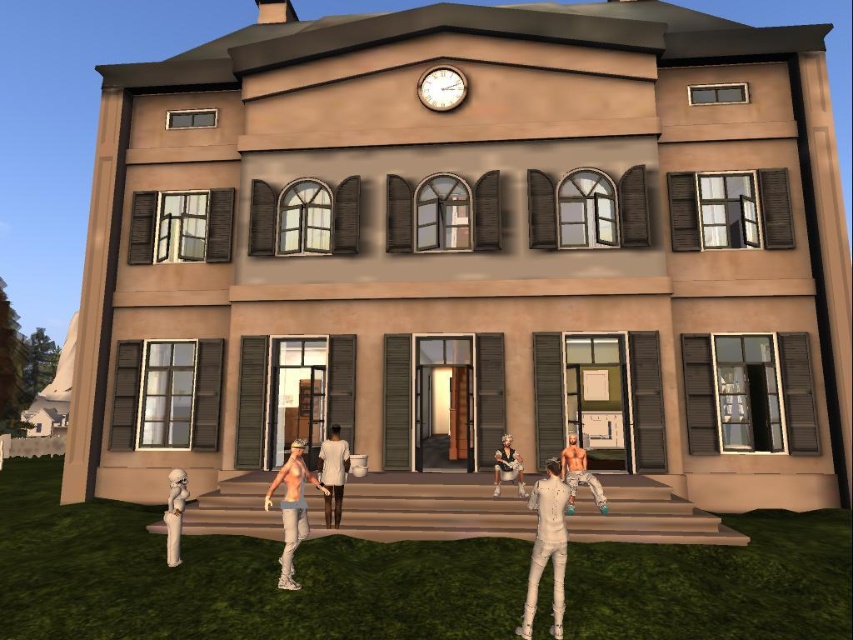
Question: Which object is farther from the camera taking this photo?

Choices:
 (A) white matte suit at lower right
 (B) white matte shirt at center
 (C) white matte dress at center
 (D) shiny metallic pants at center

Answer: (C)

Question: Which is nearer to the shiny metallic pants at center?

Choices:
 (A) white matte suit at lower right
 (B) matte black dress at center
 (C) white matte dress at center

Answer: (B)

Question: Which of these objects is positioned closest to the white matte suit at lower right?

Choices:
 (A) wooden clock at upper center
 (B) shiny metallic pants at center
 (C) white matte dress at center

Answer: (B)

Question: Does white matte dress at center appear on the left side of white glossy pipe at lower left?

Choices:
 (A) no
 (B) yes

Answer: (A)

Question: Is the position of white matte suit at lower right less distant than that of white matte shirt at center?

Choices:
 (A) yes
 (B) no

Answer: (A)

Question: Where is white matte suit at lower right located in relation to matte black dress at center in the image?

Choices:
 (A) left
 (B) right

Answer: (A)